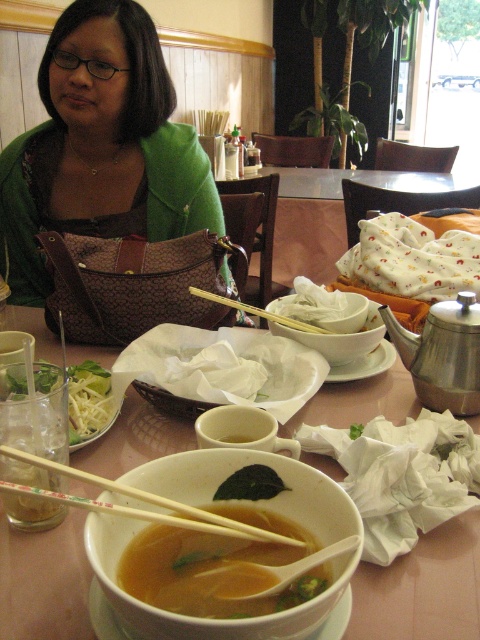
You are a server who needs to place a new dish on the table without touching the existing translucent ceramic bowl at center or the translucent broth soup at center. What is the minimum distance you should keep between the new dish and the existing items?

The minimum distance you should keep between the new dish and the existing translucent ceramic bowl at center and translucent broth soup at center is 1.49 inches to avoid touching them.

Based on the photo, you are a server at the restaurant and need to determine which item is shorter between the wooden chopsticks at bowl center and the translucent glass cup at lower left. Which one is shorter?

The wooden chopsticks at bowl center has a lesser height compared to the translucent glass cup at lower left, so the wooden chopsticks at bowl center is shorter.

You are a waiter at the restaurant and need to place a new dish on the table. The dish must be placed exactly at the point with coordinates point [205,502]. What object is located at that point?

The point [205,502] corresponds to the translucent ceramic bowl at center, so placing the dish there would mean putting it directly on top of the translucent ceramic bowl at center.